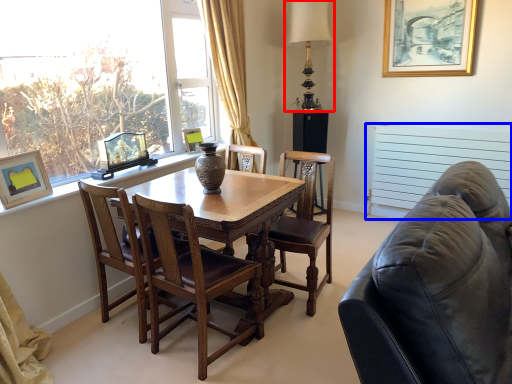
Question: Which object is further to the camera taking this photo, table lamp (highlighted by a red box) or radiator (highlighted by a blue box)?

Choices:
 (A) table lamp
 (B) radiator

Answer: (A)